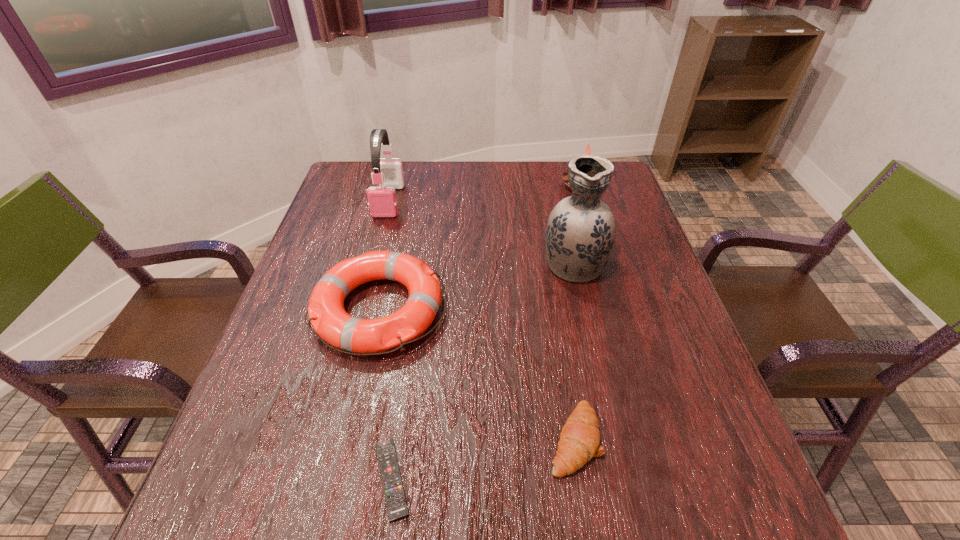
Locate an element on the screen. This screenshot has height=540, width=960. candle that is positioned at the right edge is located at coordinates (564, 176).

I want to click on object located at the far left corner, so click(x=382, y=201).

Where is `object that is at the far right corner`? The width and height of the screenshot is (960, 540). object that is at the far right corner is located at coordinates (564, 176).

Image resolution: width=960 pixels, height=540 pixels. In order to click on free space at the far edge in this screenshot , I will do `click(462, 178)`.

This screenshot has width=960, height=540. In the image, there is a desktop. Find the location of `vacant space at the left edge`. vacant space at the left edge is located at coordinates (276, 418).

The height and width of the screenshot is (540, 960). What are the coordinates of `vacant space at the right edge of the desktop` in the screenshot? It's located at (675, 308).

In order to click on free spot at the far left corner of the desktop in this screenshot , I will do `click(354, 176)`.

In the image, there is a desktop. Identify the location of free space at the far right corner. (627, 190).

Find the location of a particular element. The image size is (960, 540). empty space between the vase and the fourth tallest object is located at coordinates (476, 286).

This screenshot has width=960, height=540. What are the coordinates of `free space between the fifth tallest object and the remote control` in the screenshot? It's located at (483, 459).